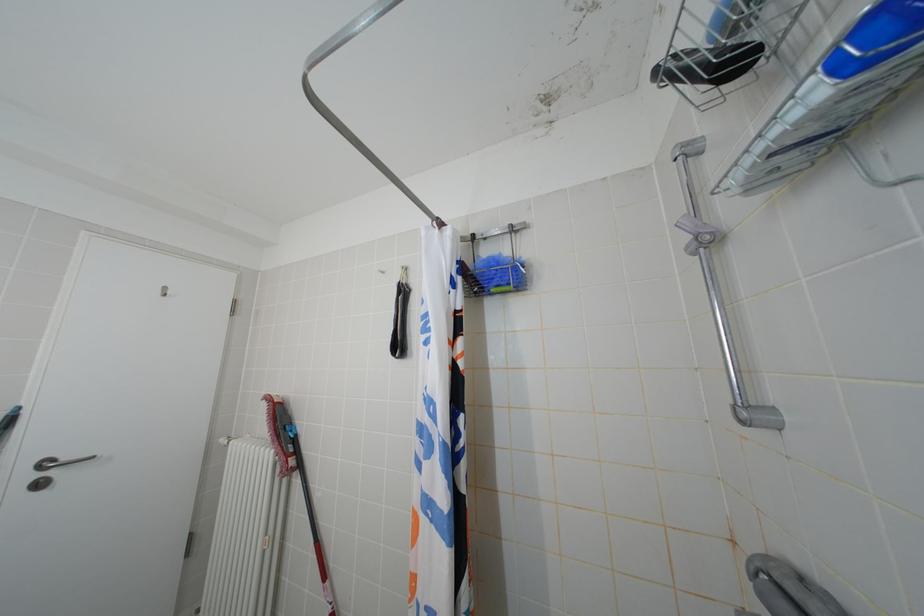
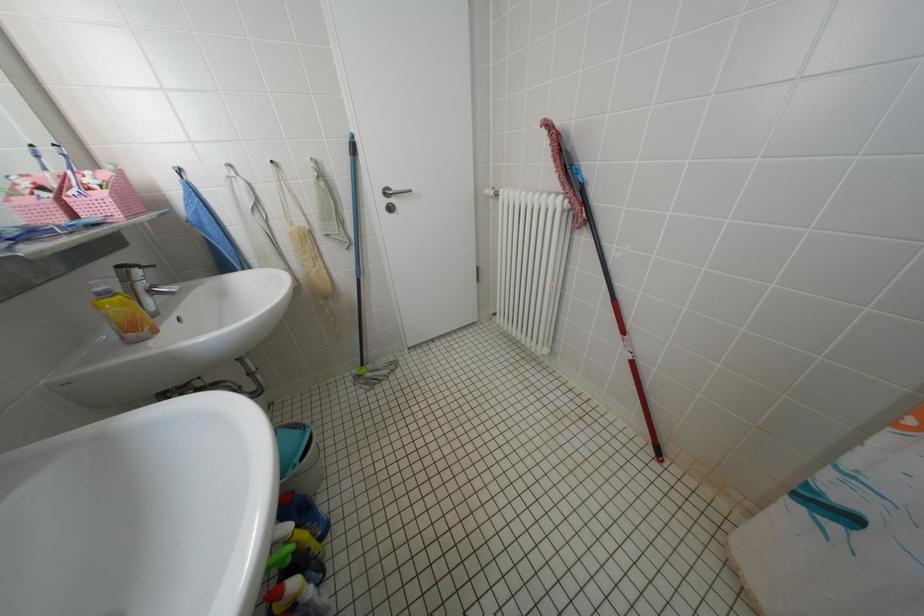
The first image is from the beginning of the video and the second image is from the end. How did the camera likely rotate when shooting the video?

The camera's rotation is toward left-down.